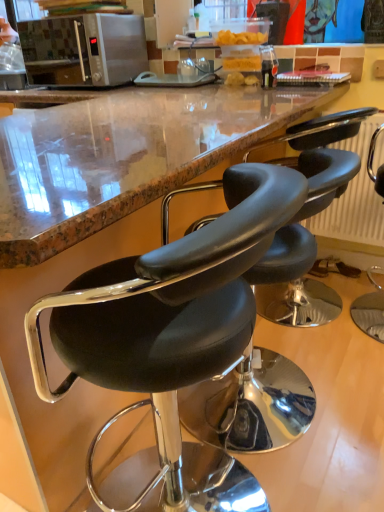
Where is `satin silver microwave at upper left`? The width and height of the screenshot is (384, 512). satin silver microwave at upper left is located at coordinates (84, 49).

The image size is (384, 512). Find the location of `black leather stool at center, positioned as the first chair in left-to-right order`. black leather stool at center, positioned as the first chair in left-to-right order is located at coordinates (170, 327).

Do you think black leather stool at center, the 2th chair from the right, is within black leather chair at right, which appears as the first chair when viewed from the right, or outside of it?

black leather stool at center, the 2th chair from the right, exists outside the volume of black leather chair at right, which appears as the first chair when viewed from the right.

Does black leather stool at center, the 2th chair from the right, appear on the left side of black leather chair at right, the 3th chair in the left-to-right sequence?

Indeed, black leather stool at center, the 2th chair from the right, is positioned on the left side of black leather chair at right, the 3th chair in the left-to-right sequence.

Is black leather stool at center, the 2th chair from the right, smaller than black leather chair at right, which appears as the first chair when viewed from the right?

Incorrect, black leather stool at center, the 2th chair from the right, is not smaller in size than black leather chair at right, which appears as the first chair when viewed from the right.

Is black leather chair at right, which appears as the first chair when viewed from the right, at the back of black leather stool at center, the 2th chair from the left?

No, black leather stool at center, the 2th chair from the left,'s orientation is not away from black leather chair at right, which appears as the first chair when viewed from the right.

Looking at their sizes, would you say black leather chair at right, which appears as the first chair when viewed from the right, is wider or thinner than satin silver microwave at upper left?

black leather chair at right, which appears as the first chair when viewed from the right, is thinner than satin silver microwave at upper left.

Between black leather chair at right, the 3th chair in the left-to-right sequence, and satin silver microwave at upper left, which one has more height?

black leather chair at right, the 3th chair in the left-to-right sequence, is taller.

Are black leather chair at right, which appears as the first chair when viewed from the right, and satin silver microwave at upper left located far from each other?

Yes, black leather chair at right, which appears as the first chair when viewed from the right, is far from satin silver microwave at upper left.

In terms of height, does black leather stool at center, the 2th chair from the left, look taller or shorter compared to satin silver microwave at upper left?

Clearly, black leather stool at center, the 2th chair from the left, is taller compared to satin silver microwave at upper left.

Considering the sizes of objects black leather stool at center, the 2th chair from the left, and satin silver microwave at upper left in the image provided, who is smaller, black leather stool at center, the 2th chair from the left, or satin silver microwave at upper left?

satin silver microwave at upper left.

Is black leather stool at center, the 2th chair from the left, further to the viewer compared to satin silver microwave at upper left?

That is False.

From a real-world perspective, does black leather stool at center, the 2th chair from the right, sit lower than satin silver microwave at upper left?

Yes, from a real-world perspective, black leather stool at center, the 2th chair from the right, is under satin silver microwave at upper left.

How many degrees apart are the facing directions of satin silver microwave at upper left and black leather stool at center, the 2th chair from the left?

90 degrees separate the facing orientations of satin silver microwave at upper left and black leather stool at center, the 2th chair from the left.

Is satin silver microwave at upper left taller than black leather stool at center, the 2th chair from the right?

No.

Measure the distance between satin silver microwave at upper left and black leather stool at center, the 2th chair from the right.

satin silver microwave at upper left and black leather stool at center, the 2th chair from the right, are 3.12 meters apart from each other.

Image resolution: width=384 pixels, height=512 pixels. Find the location of `microwave oven behind the black leather stool at center, the 2th chair from the left`. microwave oven behind the black leather stool at center, the 2th chair from the left is located at coordinates (84, 49).

Consider the image. How much distance is there between satin silver microwave at upper left and black leather stool at center, positioned as the first chair in left-to-right order?

They are 3.30 meters apart.

Which object is thinner, satin silver microwave at upper left or black leather stool at center, positioned as the first chair in left-to-right order?

satin silver microwave at upper left is thinner.

Does point (34, 27) come closer to viewer compared to point (124, 485)?

No, (34, 27) is behind (124, 485).

From the image's perspective, which one is positioned higher, satin silver microwave at upper left or black leather stool at center, arranged as the third chair when viewed from the right?

satin silver microwave at upper left, from the image's perspective.

Looking at this image, is black leather chair at right, which appears as the first chair when viewed from the right, positioned beyond the bounds of black leather stool at center, the 2th chair from the right?

Absolutely, black leather chair at right, which appears as the first chair when viewed from the right, is external to black leather stool at center, the 2th chair from the right.

From a real-world perspective, which is physically above, black leather chair at right, which appears as the first chair when viewed from the right, or black leather stool at center, the 2th chair from the left?

black leather chair at right, which appears as the first chair when viewed from the right.

The height and width of the screenshot is (512, 384). In order to click on chair that appears on the right of black leather stool at center, the 2th chair from the left in this screenshot , I will do `click(370, 309)`.

Considering the positions of objects black leather stool at center, arranged as the third chair when viewed from the right, and satin silver microwave at upper left in the image provided, who is more to the left, black leather stool at center, arranged as the third chair when viewed from the right, or satin silver microwave at upper left?

satin silver microwave at upper left is more to the left.

Looking at their sizes, would you say black leather stool at center, positioned as the first chair in left-to-right order, is wider or thinner than satin silver microwave at upper left?

black leather stool at center, positioned as the first chair in left-to-right order, is wider than satin silver microwave at upper left.

Is black leather stool at center, positioned as the first chair in left-to-right order, oriented towards satin silver microwave at upper left?

No, black leather stool at center, positioned as the first chair in left-to-right order, is not aimed at satin silver microwave at upper left.

Does black leather stool at center, positioned as the first chair in left-to-right order, have a greater height compared to satin silver microwave at upper left?

Indeed, black leather stool at center, positioned as the first chair in left-to-right order, has a greater height compared to satin silver microwave at upper left.

Image resolution: width=384 pixels, height=512 pixels. In the image, there is a black leather chair at right, which appears as the first chair when viewed from the right. Find the location of `chair below it (from a real-world perspective)`. chair below it (from a real-world perspective) is located at coordinates (251, 406).

The width and height of the screenshot is (384, 512). I want to click on the 1st chair in front of the satin silver microwave at upper left, starting your count from the anchor, so click(370, 309).

From the image, which object appears to be farther from black leather chair at right, the 3th chair in the left-to-right sequence, black leather stool at center, positioned as the first chair in left-to-right order, or satin silver microwave at upper left?

Based on the image, satin silver microwave at upper left appears to be further to black leather chair at right, the 3th chair in the left-to-right sequence.

Looking at the image, which one is located closer to black leather stool at center, the 2th chair from the right, black leather stool at center, arranged as the third chair when viewed from the right, or black leather chair at right, which appears as the first chair when viewed from the right?

Based on the image, black leather stool at center, arranged as the third chair when viewed from the right, appears to be nearer to black leather stool at center, the 2th chair from the right.

Looking at the image, which one is located further to black leather stool at center, arranged as the third chair when viewed from the right, black leather chair at right, which appears as the first chair when viewed from the right, or satin silver microwave at upper left?

satin silver microwave at upper left is further to black leather stool at center, arranged as the third chair when viewed from the right.

From the image, which object appears to be nearer to satin silver microwave at upper left, black leather chair at right, which appears as the first chair when viewed from the right, or black leather stool at center, positioned as the first chair in left-to-right order?

black leather chair at right, which appears as the first chair when viewed from the right, is positioned closer to the anchor satin silver microwave at upper left.

Estimate the real-world distances between objects in this image. Which object is closer to black leather stool at center, arranged as the third chair when viewed from the right, black leather stool at center, the 2th chair from the left, or satin silver microwave at upper left?

black leather stool at center, the 2th chair from the left, lies closer to black leather stool at center, arranged as the third chair when viewed from the right, than the other object.

Estimate the real-world distances between objects in this image. Which object is further from black leather stool at center, the 2th chair from the right, black leather chair at right, the 3th chair in the left-to-right sequence, or black leather stool at center, arranged as the third chair when viewed from the right?

The object further to black leather stool at center, the 2th chair from the right, is black leather chair at right, the 3th chair in the left-to-right sequence.

Based on their spatial positions, is black leather stool at center, positioned as the first chair in left-to-right order, or black leather chair at right, which appears as the first chair when viewed from the right, closer to satin silver microwave at upper left?

The object closer to satin silver microwave at upper left is black leather chair at right, which appears as the first chair when viewed from the right.

Looking at the image, which one is located further to black leather chair at right, the 3th chair in the left-to-right sequence, satin silver microwave at upper left or black leather stool at center, positioned as the first chair in left-to-right order?

satin silver microwave at upper left is positioned further to the anchor black leather chair at right, the 3th chair in the left-to-right sequence.

You are a GUI agent. You are given a task and a screenshot of the screen. Output one action in this format:
    pyautogui.click(x=<x>, y=<y>)
    Task: Click on the chair between black leather stool at center, positioned as the first chair in left-to-right order, and black leather chair at right, which appears as the first chair when viewed from the right, along the z-axis
    This screenshot has width=384, height=512.
    Given the screenshot: What is the action you would take?
    pyautogui.click(x=251, y=406)